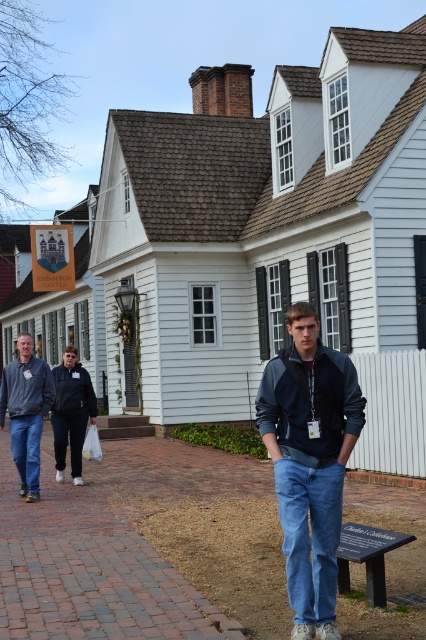
Question: Which point appears closest to the camera in this image?

Choices:
 (A) (334, 490)
 (B) (192, 497)

Answer: (A)

Question: Which of the following is the farthest from the observer?

Choices:
 (A) brick pavement at center
 (B) denim jacket at center

Answer: (A)

Question: Can you confirm if brick pavement at center is wider than gray fleece jacket at left?

Choices:
 (A) yes
 (B) no

Answer: (A)

Question: Does brick pavement at center appear on the right side of gray fleece jacket at left?

Choices:
 (A) no
 (B) yes

Answer: (B)

Question: Which of the following is the farthest from the observer?

Choices:
 (A) denim jacket at center
 (B) brick pavement at center

Answer: (B)

Question: Does brick pavement at center have a greater width compared to gray fleece jacket at left?

Choices:
 (A) no
 (B) yes

Answer: (B)